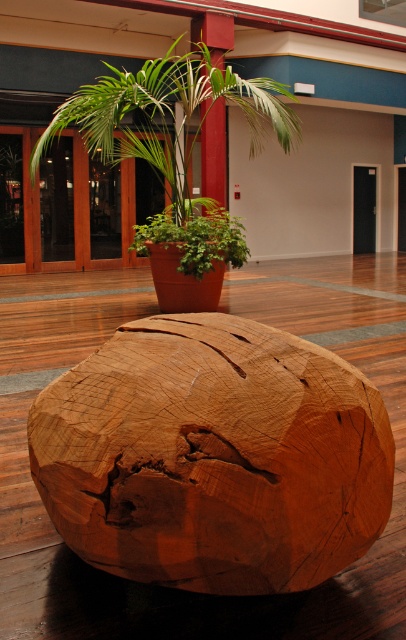
Can you confirm if wooden sphere at center is wider than green leafy plant at center?

No.

Identify the location of wooden sphere at center. (213, 456).

Who is shorter, green leafy plant at upper center or green leafy plant at center?

Standing shorter between the two is green leafy plant at upper center.

Is green leafy plant at upper center taller than green leafy plant at center?

No.

In the scene shown: Measure the distance between point [179,76] and camera.

The distance of point [179,76] from camera is 9.35 meters.

At what (x,y) coordinates should I click in order to perform the action: click on green leafy plant at upper center. Please return your answer as a coordinate pair (x, y). Looking at the image, I should click on (166, 115).

Which is behind, point (319, 403) or point (278, 128)?

The point (278, 128) is behind.

Is point (162, 321) farther from camera compared to point (114, 77)?

No.

I want to click on wooden sphere at center, so click(213, 456).

Where is `wooden sphere at center`? This screenshot has height=640, width=406. wooden sphere at center is located at coordinates (213, 456).